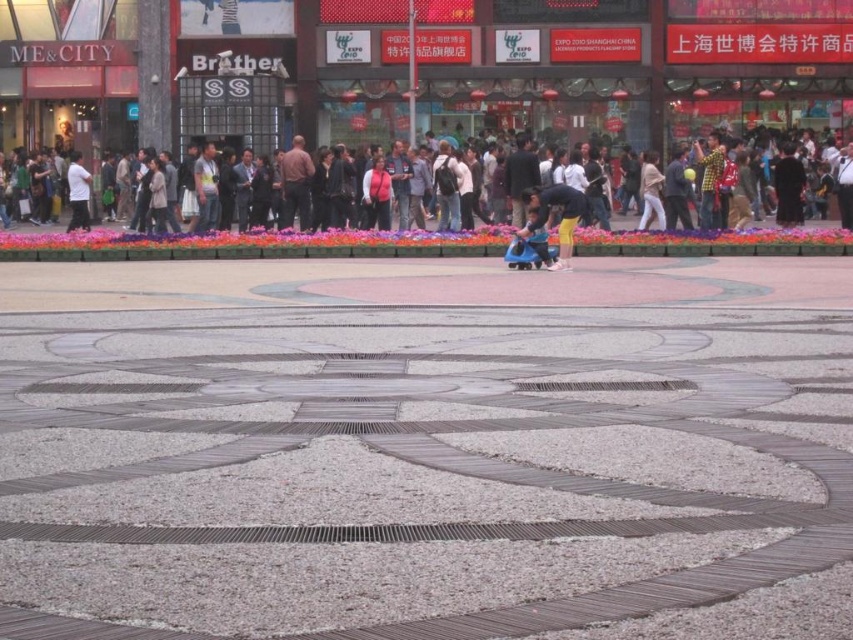
You are standing in the public square and want to know how far you are from the point marked as point (270, 109). Can you determine the distance?

The distance between you and point (270, 109) is 34.04 meters.